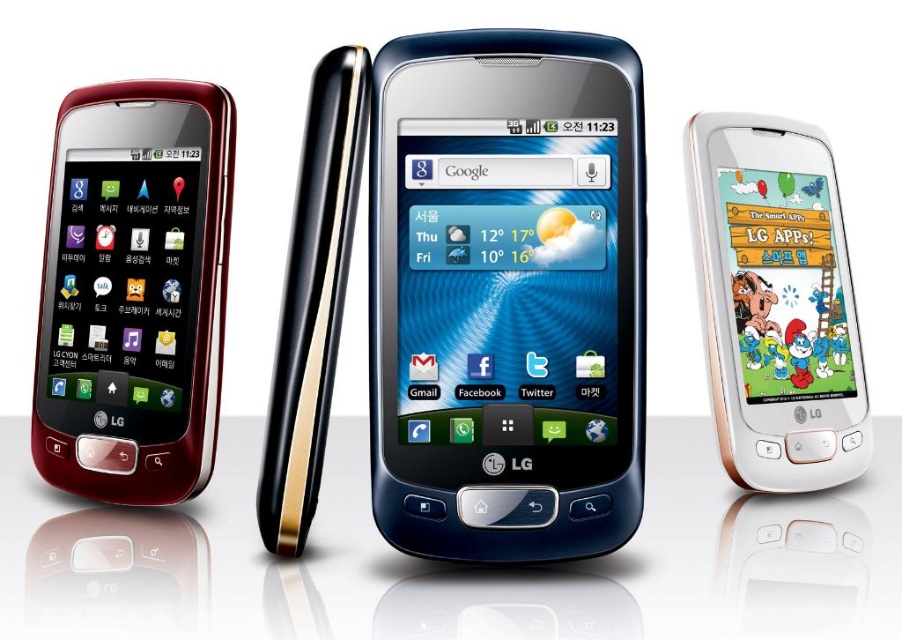
You are holding a matte black phone at left and a white glossy phone at right. Which one is bigger?

The white glossy phone at right is bigger than the matte black phone at left.

You are a delivery person who needs to place a 25 cm wide box between the satin black phone at center and the matte black phone at left. Can the box fit in the space between them?

The distance between the satin black phone at center and the matte black phone at left is 26.83 centimeters. Since the box is 25 cm wide, it can fit in the space between them as 25 cm is less than 26.83 cm.

You are holding a smartphone and want to place it on a shelf. The shelf has limited depth. You have two phones in front of you, the satin black phone at center and the matte black phone at left. Which phone should you choose to ensure it fits on the shelf without overhanging?

The matte black phone at left is further away from the viewer, meaning it has a smaller depth. Therefore, the matte black phone at left would fit better on the shelf with limited depth.